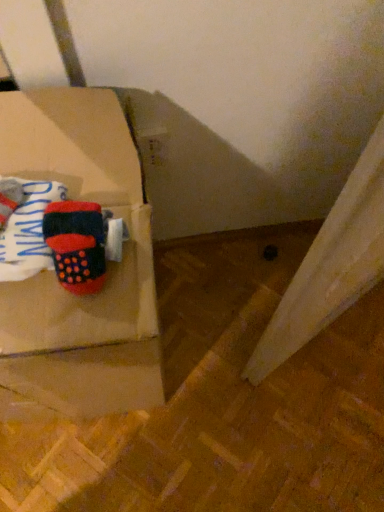
Find the location of a particular element. This screenshot has height=512, width=384. vacant space behind velvet-like red phone at upper left is located at coordinates (79, 155).